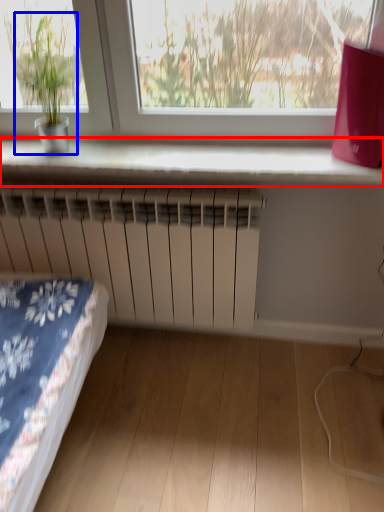
Question: Which object appears farthest to the camera in this image, window sill (highlighted by a red box) or houseplant (highlighted by a blue box)?

Choices:
 (A) window sill
 (B) houseplant

Answer: (A)